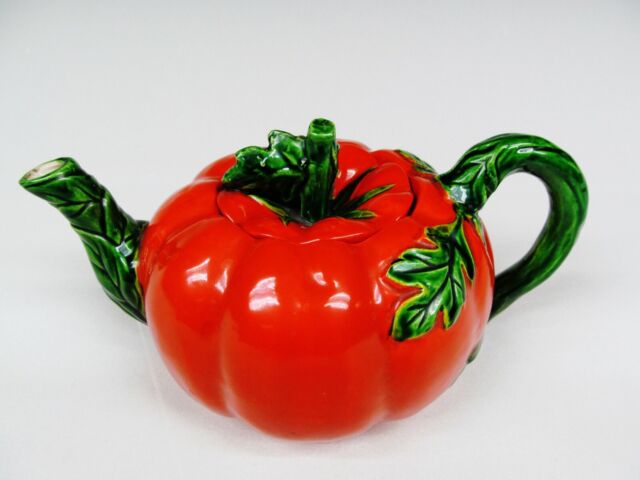
You are a GUI agent. You are given a task and a screenshot of the screen. Output one action in this format:
    pyautogui.click(x=<x>, y=<y>)
    Task: Click on the tea pot spout
    This screenshot has height=480, width=640.
    Given the screenshot: What is the action you would take?
    pyautogui.click(x=92, y=205)